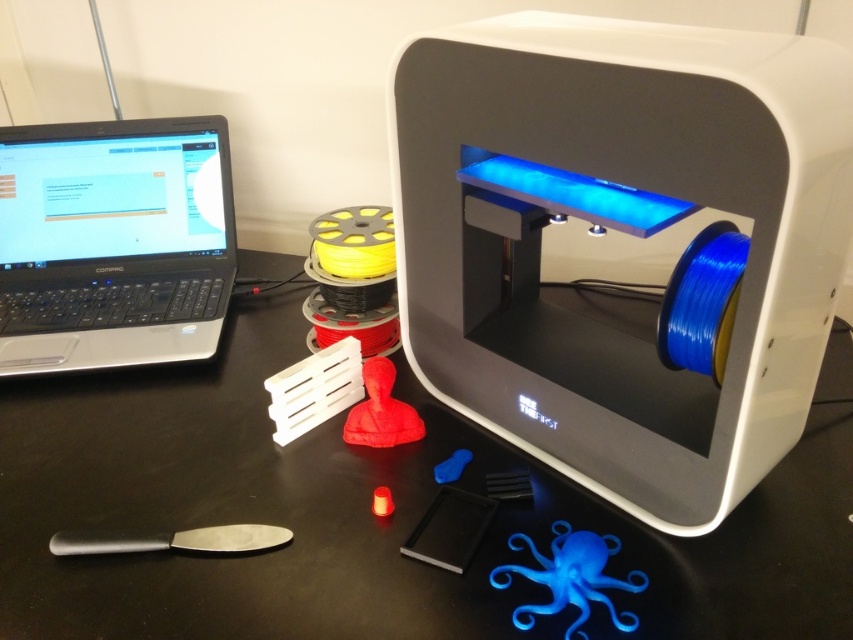
In the scene shown: Who is more forward, [453,234] or [403,419]?

Point [453,234]

Is white plastic 3d printer at center thinner than matte red bust at center?

In fact, white plastic 3d printer at center might be wider than matte red bust at center.

At what (x,y) coordinates should I click in order to perform the action: click on white plastic 3d printer at center. Please return your answer as a coordinate pair (x, y). Image resolution: width=853 pixels, height=640 pixels. Looking at the image, I should click on (622, 230).

Can you confirm if silver/black plastic laptop at upper left is positioned above blue matte octopus at lower right?

Indeed, silver/black plastic laptop at upper left is positioned over blue matte octopus at lower right.

Does silver/black plastic laptop at upper left appear under blue matte octopus at lower right?

No.

The height and width of the screenshot is (640, 853). I want to click on silver/black plastic laptop at upper left, so click(x=113, y=243).

Find the location of a particular element. The image size is (853, 640). white plastic 3d printer at center is located at coordinates (x=622, y=230).

Does white plastic 3d printer at center have a greater width compared to black matte spatula at lower left?

Yes, white plastic 3d printer at center is wider than black matte spatula at lower left.

This screenshot has height=640, width=853. Find the location of `white plastic 3d printer at center`. white plastic 3d printer at center is located at coordinates (622, 230).